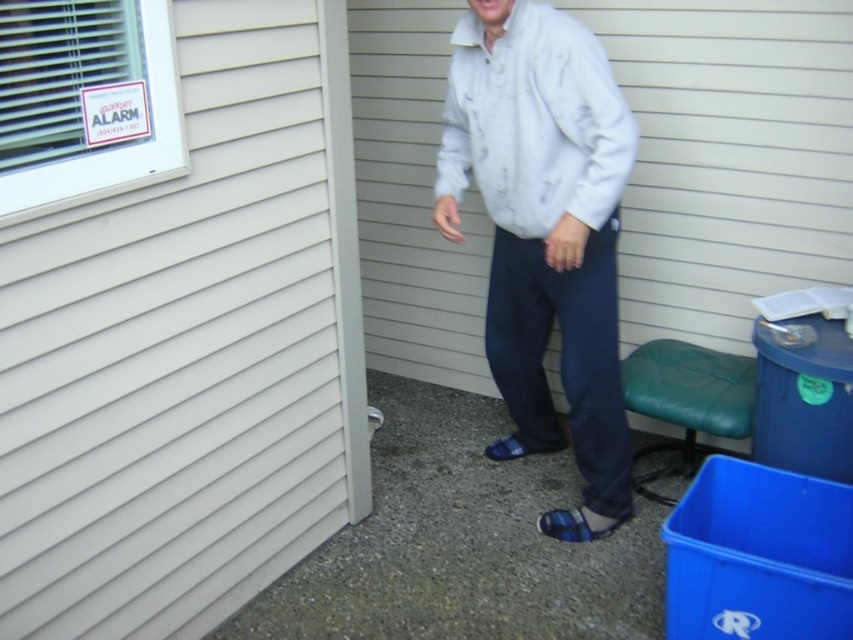
You are a delivery person trying to locate the correct entrance to a building. The building has beige siding. You see a point marked at coordinates (178, 321) which is on the white siding at upper left. Where should you go to find the entrance?

The entrance is likely near the lower part of the building since the point marked at (178, 321) is on the white siding at upper left, indicating the entrance is below that area.

You are a delivery person trying to locate the emergency alarm. You see the white siding at upper left and the blue recycling bin on the right. Based on their positions, which object is closer to the front of the building?

The white siding at upper left is located at point [178,321] which is closer to the front of the building compared to the blue recycling bin on the right.

You are standing in front of a building and see the white siding at upper left and the light gray cotton jacket at center. Which object takes up more space in the image?

The white siding at upper left takes up more space in the image because it is bigger than the light gray cotton jacket at center.